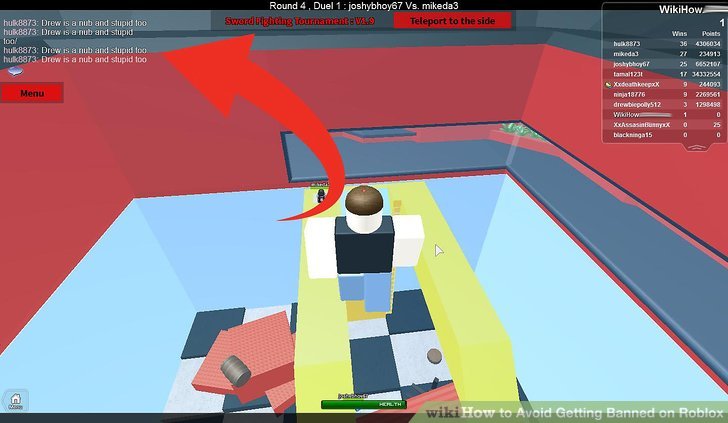
Where is `red pads on floor`? This screenshot has width=728, height=423. red pads on floor is located at coordinates (276, 357), (210, 378), (280, 390).